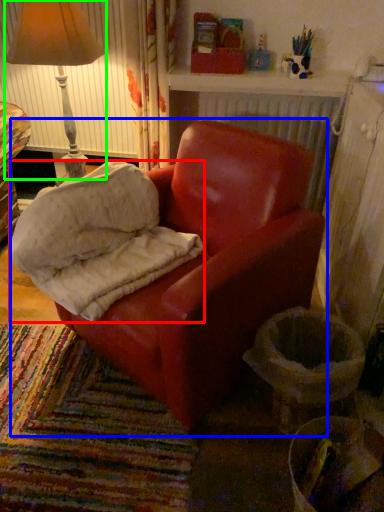
Question: Estimate the real-world distances between objects in this image. Which object is farther from material (highlighted by a red box), chair (highlighted by a blue box) or lamp (highlighted by a green box)?

Choices:
 (A) chair
 (B) lamp

Answer: (B)